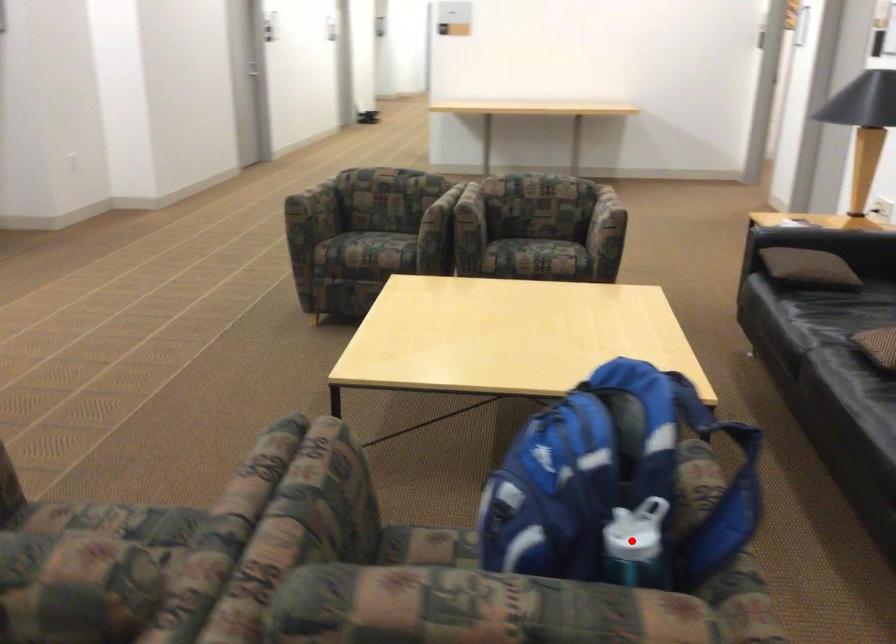
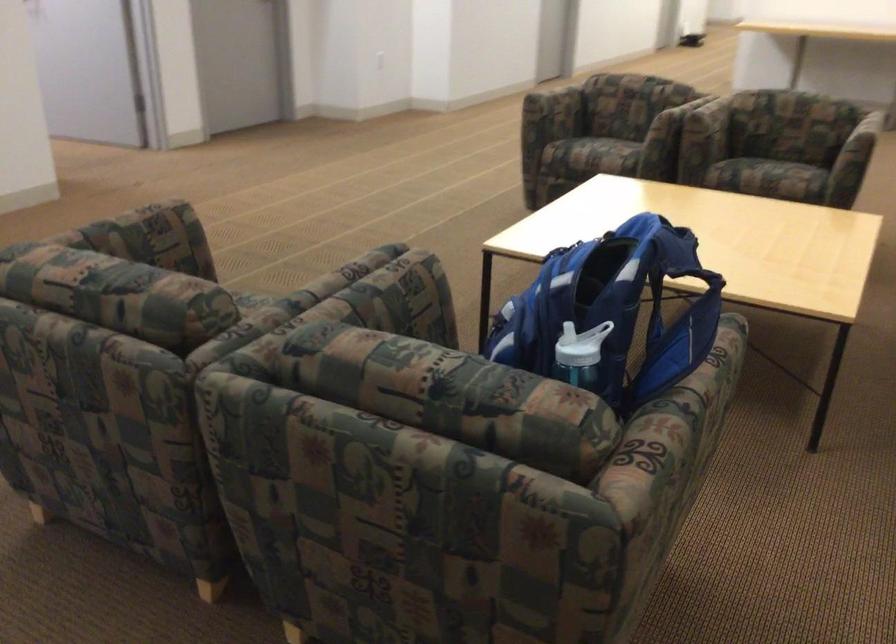
Question: I am providing you with two images of the same scene from different viewpoints. A red point is shown in image1. For the corresponding object point in image2, is it positioned nearer or farther from the camera?

Choices:
 (A) Nearer
 (B) Farther

Answer: (B)